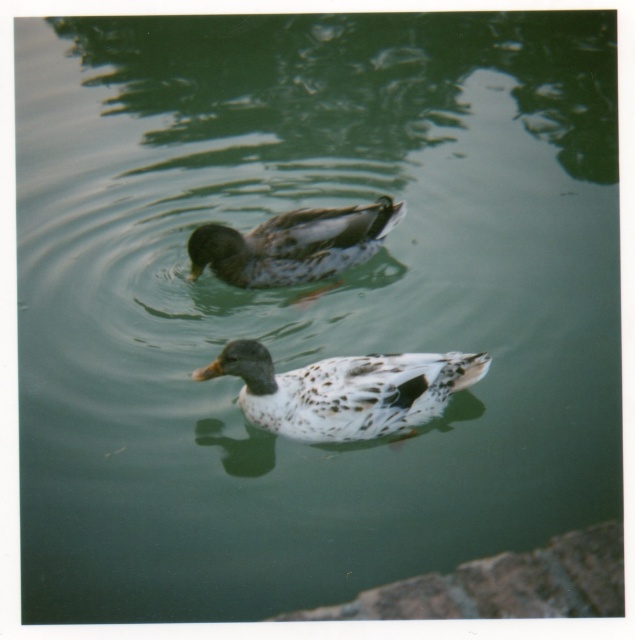
Question: Which of the following is the closest to the observer?

Choices:
 (A) speckled feathered duck at center
 (B) speckled brown duck at center

Answer: (A)

Question: Is speckled feathered duck at center bigger than speckled brown duck at center?

Choices:
 (A) yes
 (B) no

Answer: (B)

Question: Which point appears farthest from the camera in this image?

Choices:
 (A) (375, 408)
 (B) (283, 275)

Answer: (B)

Question: Which point is closer to the camera?

Choices:
 (A) speckled brown duck at center
 (B) speckled feathered duck at center

Answer: (B)

Question: Is speckled feathered duck at center to the right of speckled brown duck at center from the viewer's perspective?

Choices:
 (A) no
 (B) yes

Answer: (B)

Question: Does speckled feathered duck at center have a lesser width compared to speckled brown duck at center?

Choices:
 (A) yes
 (B) no

Answer: (B)